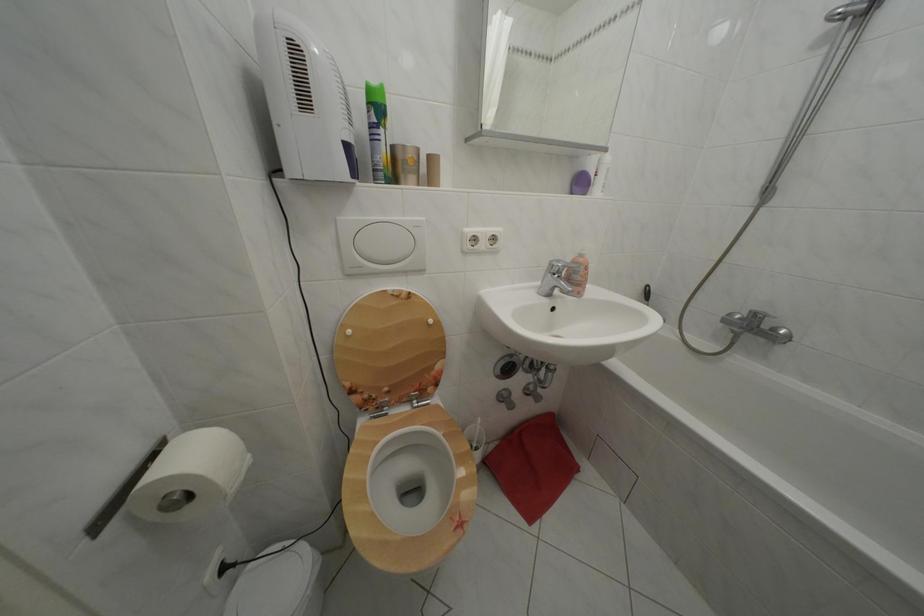
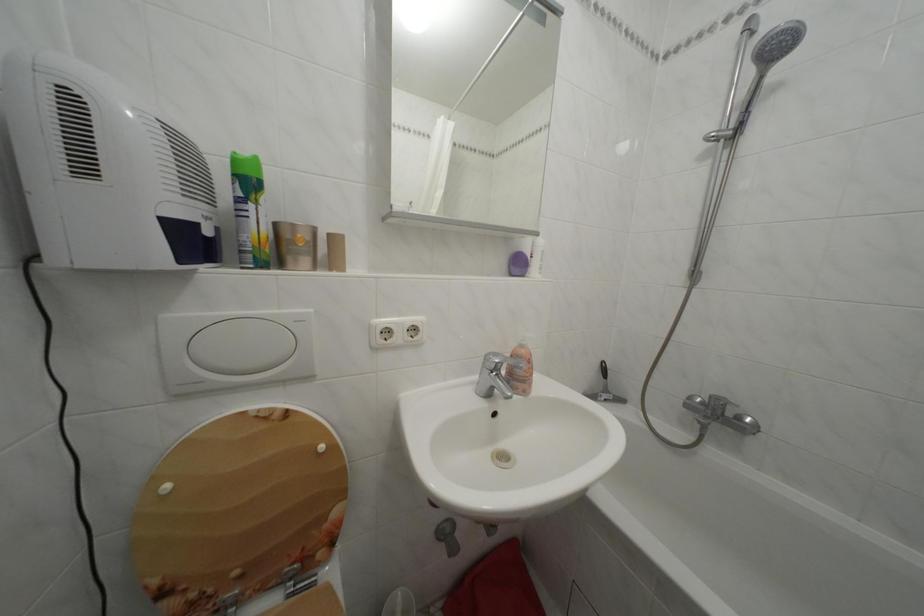
Locate, in the second image, the point that corresponds to the point at 590,262 in the first image.

(530, 352)